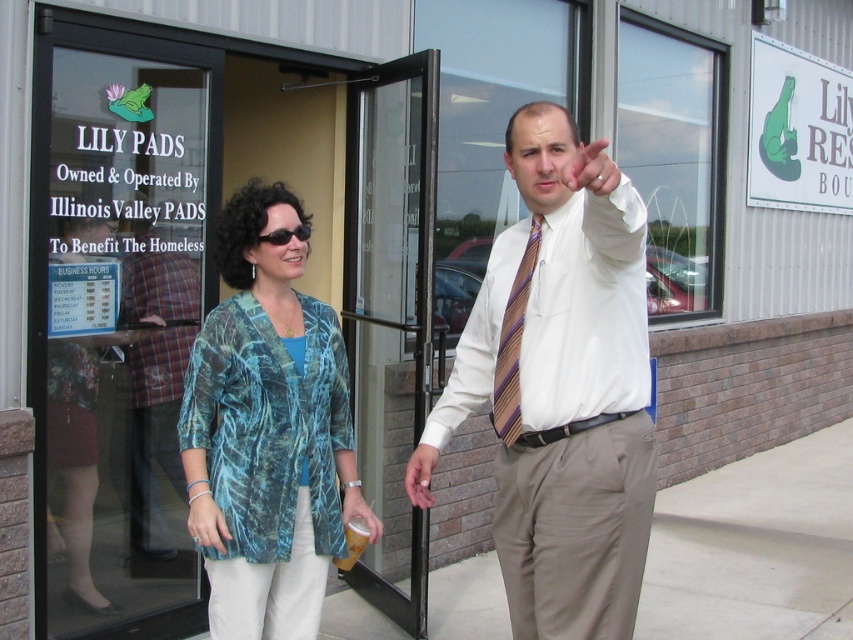
You are a photographer standing 10 feet away from the two individuals in the scene. You want to take a photo that includes both the white striped tie at center and the teal printed blouse at center without any part of them being cut off. What is the minimum width your camera lens should have to capture both objects in frame?

The white striped tie at center is 21.75 inches from the teal printed blouse at center. To capture both objects without cropping, the camera lens must have a minimum width of at least 21.75 inches.

You are a photographer taking a picture of two people standing outside a building. You notice the white striped tie at center and the teal printed blouse at center. Which clothing item is positioned closer to you?

The white striped tie at center is closer to the viewer than the teal printed blouse at center.

You are a delivery person trying to enter the building marked by the LILY PADS sign. You see the transparent glass door at upper left and the white striped tie at center. Which object should you approach first to enter the building?

You should approach the transparent glass door at upper left first to enter the building because it is located to the left of the white striped tie at center, meaning it is closer to your entry point.